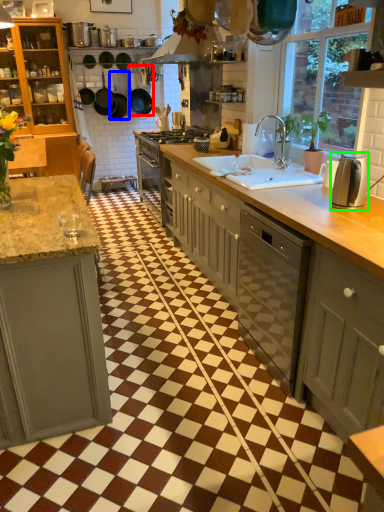
Question: Estimate the real-world distances between objects in this image. Which object is closer to frying pan (highlighted by a red box), frying pan (highlighted by a blue box) or kitchen appliance (highlighted by a green box)?

Choices:
 (A) frying pan
 (B) kitchen appliance

Answer: (A)